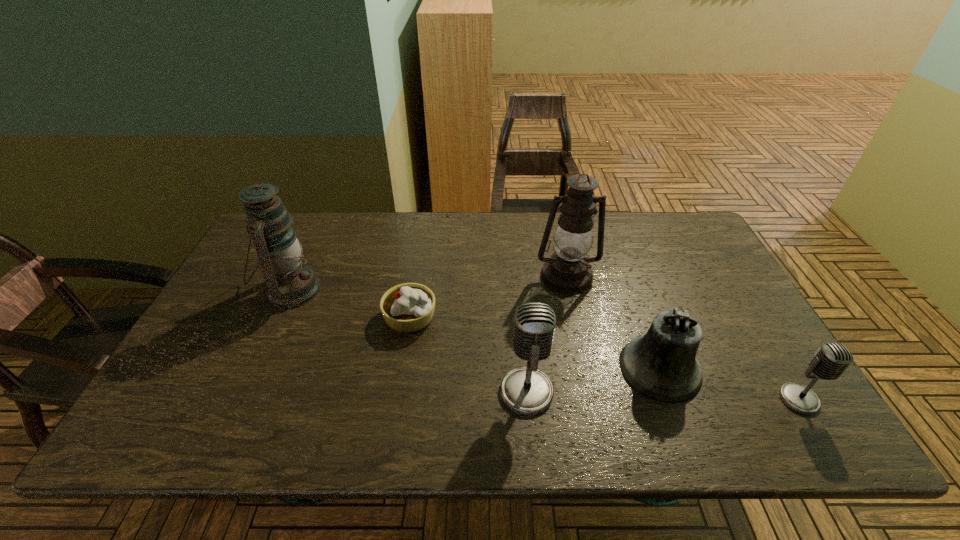
Locate an element on the screen. free location at the left edge is located at coordinates (240, 275).

Locate an element on the screen. free spot at the right edge of the desktop is located at coordinates (716, 306).

Where is `vacant region at the far right corner`? This screenshot has width=960, height=540. vacant region at the far right corner is located at coordinates (678, 249).

You are a GUI agent. You are given a task and a screenshot of the screen. Output one action in this format:
    pyautogui.click(x=<x>, y=<y>)
    Task: Click on the unoccupied position between the fifth object from right to left and the left microphone
    This screenshot has height=540, width=960.
    Given the screenshot: What is the action you would take?
    pyautogui.click(x=468, y=354)

The height and width of the screenshot is (540, 960). I want to click on vacant space that is in between the shorter microphone and the shortest object, so click(605, 358).

You are a GUI agent. You are given a task and a screenshot of the screen. Output one action in this format:
    pyautogui.click(x=<x>, y=<y>)
    Task: Click on the free area in between the shorter microphone and the fifth object from right to left
    
    Given the screenshot: What is the action you would take?
    pyautogui.click(x=605, y=358)

This screenshot has height=540, width=960. I want to click on free space that is in between the right microphone and the bell, so click(730, 383).

The height and width of the screenshot is (540, 960). Find the location of `object that ranks as the fourth closest to the taller microphone`. object that ranks as the fourth closest to the taller microphone is located at coordinates pyautogui.click(x=831, y=359).

Where is `object that is the fifth closest to the rightmost object`? This screenshot has width=960, height=540. object that is the fifth closest to the rightmost object is located at coordinates tap(290, 283).

Image resolution: width=960 pixels, height=540 pixels. What are the coordinates of `free space in the image that satisfies the following two spatial constraints: 1. on the back side of the taller microphone; 2. on the right side of the bell` in the screenshot? It's located at (524, 368).